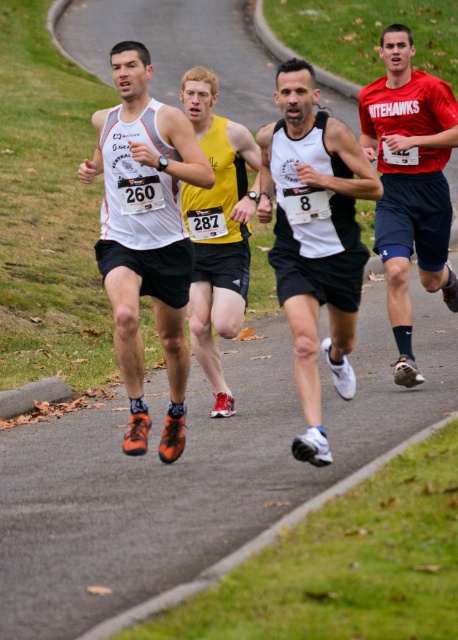
You are a photographer positioned at the starting line of the race. You want to capture a photo that includes both the matte white tank top at center and the yellow matte singlet at center. Since the runners are moving forward, which runner should you focus on to ensure both are in frame?

The matte white tank top at center is larger in size than the yellow matte singlet at center, so focusing on the matte white tank top at center will ensure both are in frame as it is closer and larger.

You are a race official observing the runners. You need to determine the current position of the matte white tank top at center and the red matte jersey at center. Based on their positions, which runner is leading the race between these two?

The matte white tank top at center is in front of the red matte jersey at center, so the matte white tank top at center is leading the race between them.